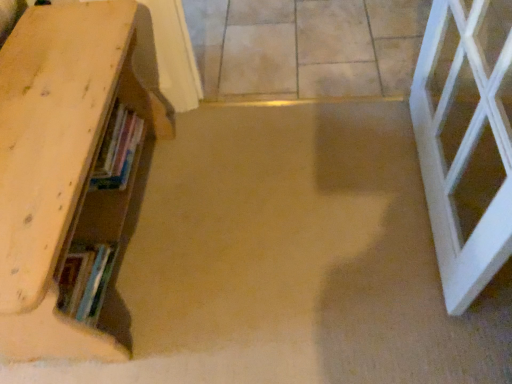
Locate an element on the screen. This screenshot has width=512, height=384. vacant area that lies to the right of wooden bookshelf at left is located at coordinates (274, 223).